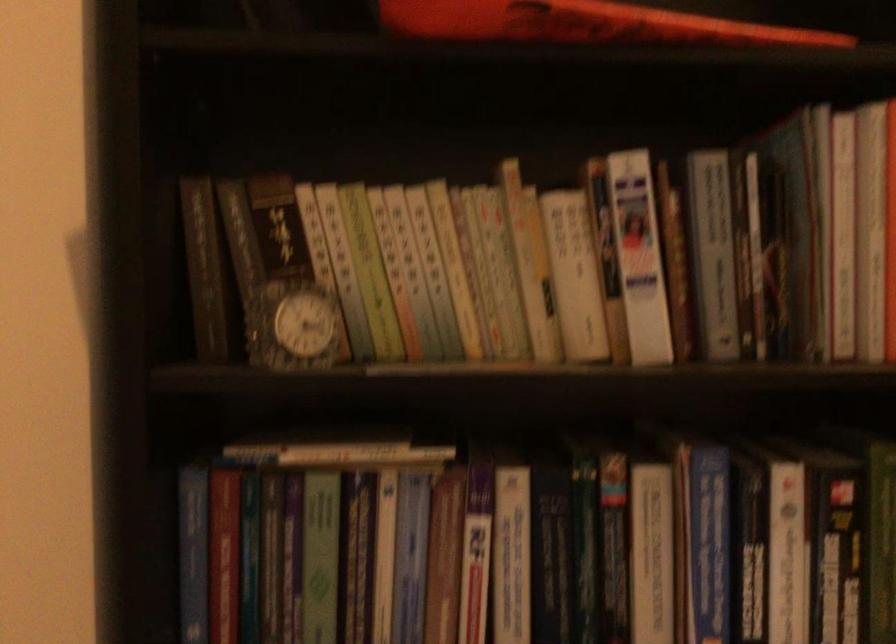
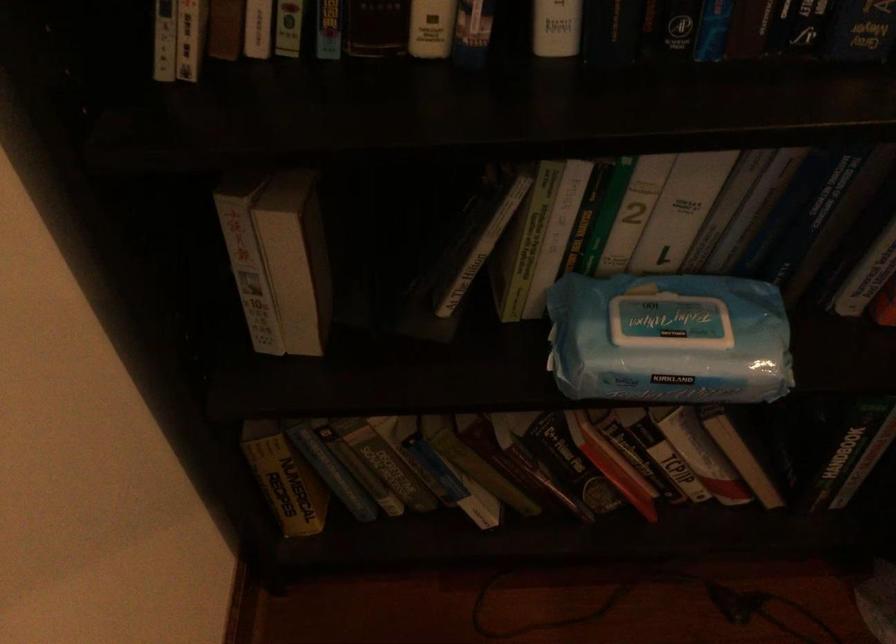
Question: Based on the continuous images, in which direction is the camera rotating? Reply with the corresponding letter.

Choices:
 (A) Left
 (B) Right
 (C) Up
 (D) Down

Answer: (D)